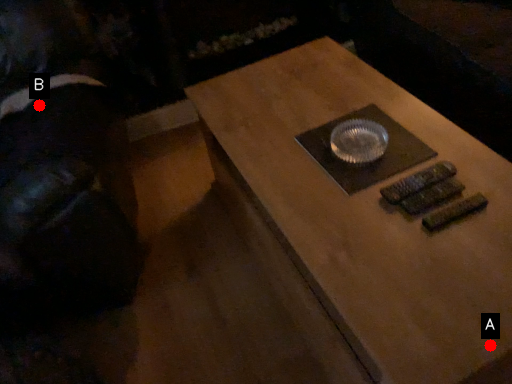
Question: Two points are circled on the image, labeled by A and B beside each circle. Among these points, which one is nearest to the camera?

Choices:
 (A) A is closer
 (B) B is closer

Answer: (A)